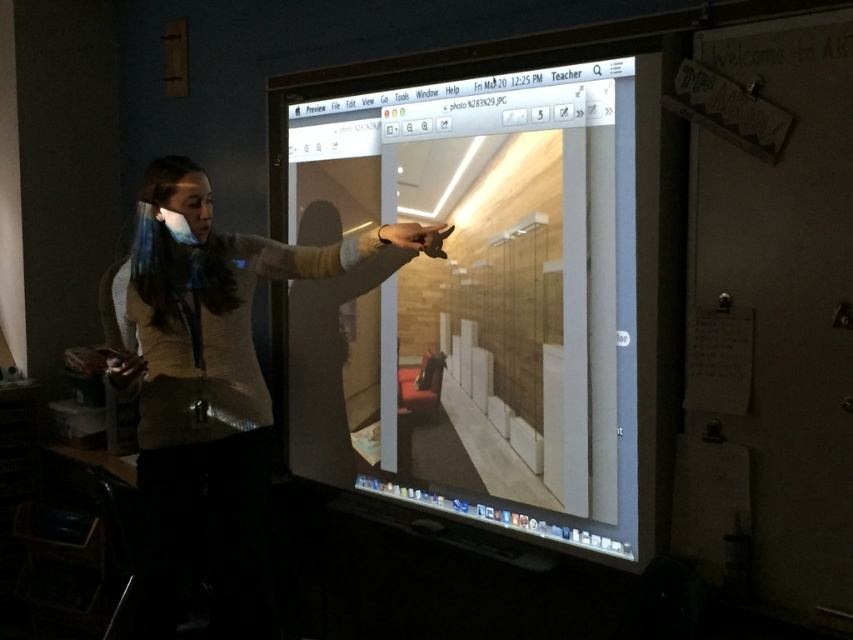
Question: Is matte wooden screen at center thinner than matte beige sweater at center?

Choices:
 (A) no
 (B) yes

Answer: (B)

Question: Is matte wooden screen at center further to camera compared to matte beige sweater at center?

Choices:
 (A) no
 (B) yes

Answer: (A)

Question: Which point is closer to the camera?

Choices:
 (A) matte wooden screen at center
 (B) matte beige sweater at center

Answer: (A)

Question: Is matte wooden screen at center thinner than matte beige sweater at center?

Choices:
 (A) no
 (B) yes

Answer: (B)